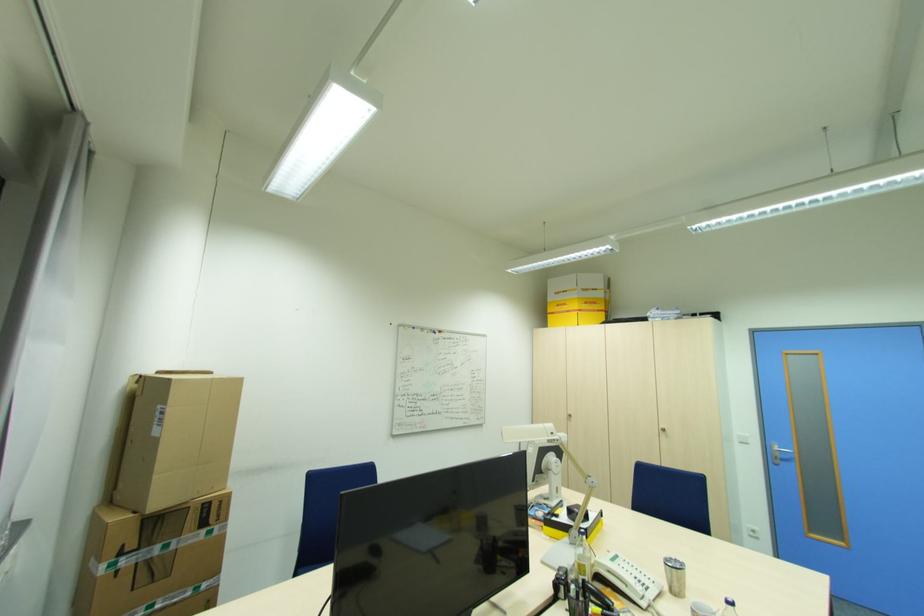
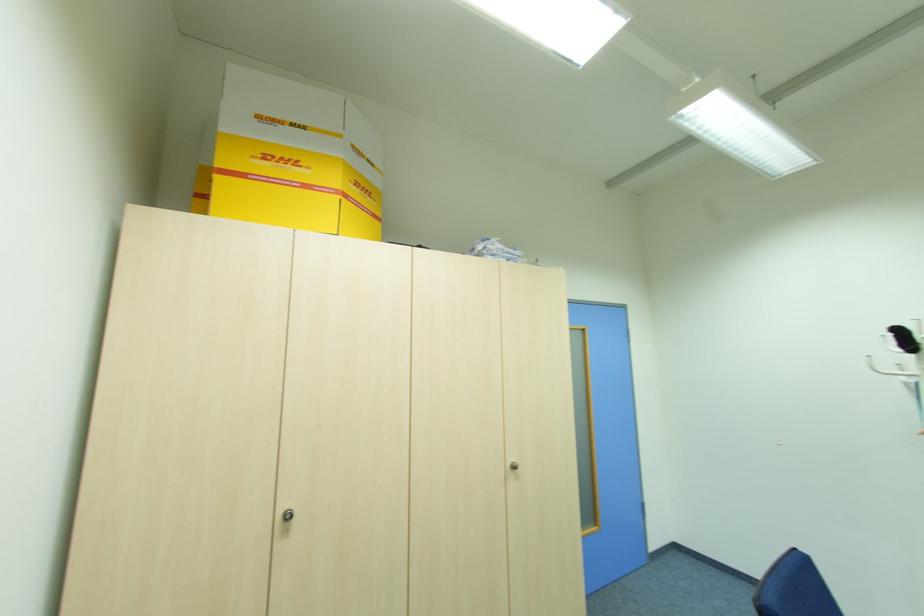
Find the pixel in the second image that matches the point at 589,304 in the first image.

(359, 185)